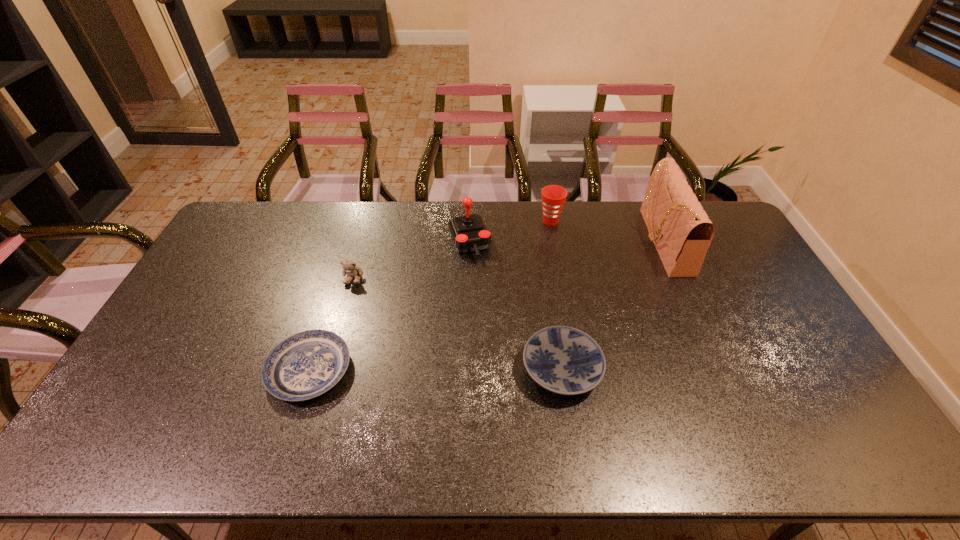
Where is `vacant space situated 0.320m on the front-facing side of the handbag`? This screenshot has height=540, width=960. vacant space situated 0.320m on the front-facing side of the handbag is located at coordinates (554, 241).

The width and height of the screenshot is (960, 540). Identify the location of free space located on the front-facing side of the handbag. (576, 241).

The height and width of the screenshot is (540, 960). Find the location of `free space located on the front-facing side of the handbag`. free space located on the front-facing side of the handbag is located at coordinates (601, 241).

Identify the location of vacant space located on the front of the third object from left to right. This screenshot has width=960, height=540. (467, 355).

At what (x,y) coordinates should I click in order to perform the action: click on blank area located 0.280m on the right of the cup. Please return your answer as a coordinate pair (x, y). The width and height of the screenshot is (960, 540). Looking at the image, I should click on (636, 221).

At what (x,y) coordinates should I click in order to perform the action: click on vacant space located 0.290m on the face of the teddy bear. Please return your answer as a coordinate pair (x, y). The image size is (960, 540). Looking at the image, I should click on (329, 362).

What are the coordinates of `free space located 0.120m on the right of the right plate` in the screenshot? It's located at (645, 369).

The image size is (960, 540). I want to click on vacant space located 0.320m on the left of the shorter plate, so click(151, 370).

This screenshot has width=960, height=540. In order to click on handbag positioned at the far edge in this screenshot , I will do `click(682, 232)`.

Identify the location of joystick that is at the far edge. (469, 233).